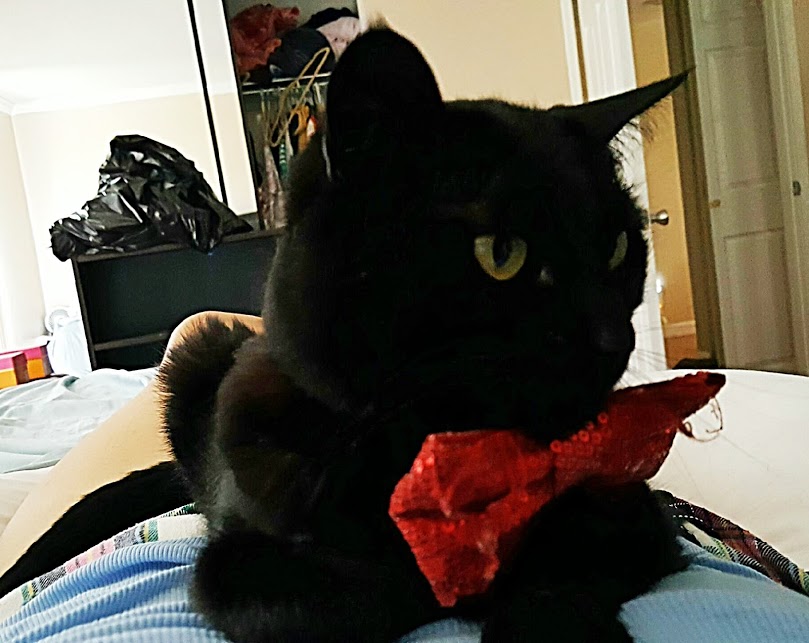
Identify the location of blue blanket. (151, 600).